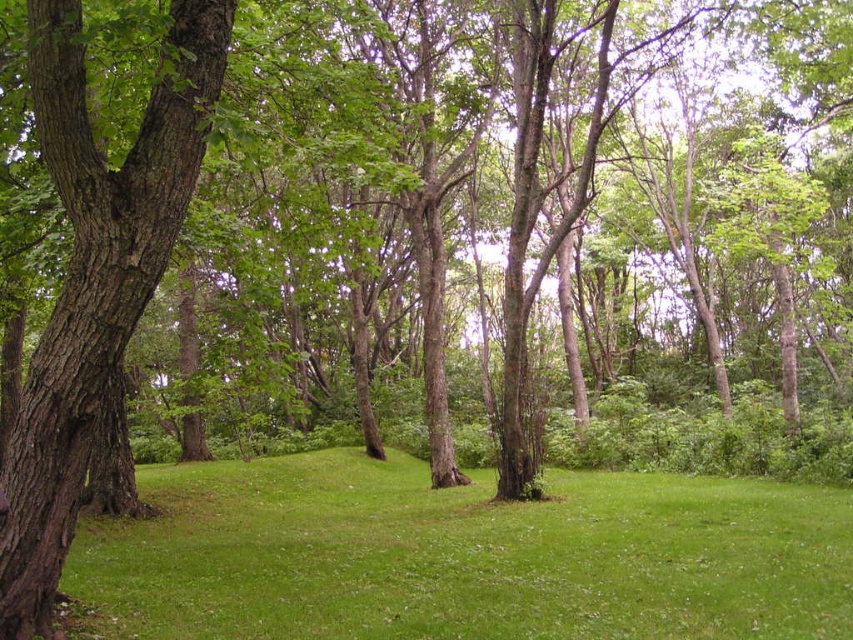
Question: Which object is closer to the camera taking this photo?

Choices:
 (A) green grassy at center
 (B) brown rough bark tree at left

Answer: (B)

Question: Does green grassy at center have a larger size compared to brown rough bark tree at left?

Choices:
 (A) yes
 (B) no

Answer: (A)

Question: Can you confirm if green grassy at center is wider than brown rough bark tree at left?

Choices:
 (A) yes
 (B) no

Answer: (A)

Question: Does green grassy at center have a lesser width compared to brown rough bark tree at left?

Choices:
 (A) yes
 (B) no

Answer: (B)